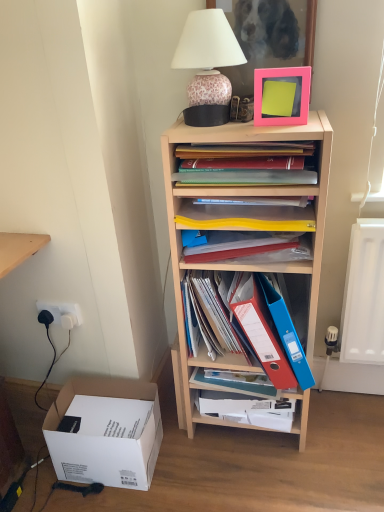
In order to click on vacant area that is in front of leopard print ceramic lamp at upper center in this screenshot , I will do click(x=234, y=128).